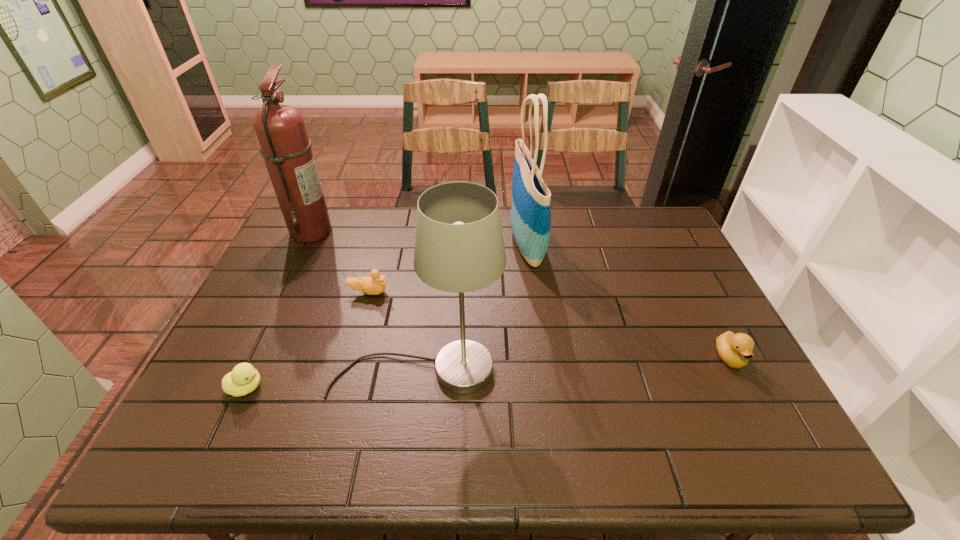
Where is `free spot between the fire extinguisher and the table lamp`? The height and width of the screenshot is (540, 960). free spot between the fire extinguisher and the table lamp is located at coordinates (364, 300).

This screenshot has width=960, height=540. I want to click on the closest object to the leftmost duckling, so click(459, 247).

Find the location of a particular element. the closest object relative to the rightmost object is located at coordinates (530, 218).

Select which duckling appears as the second closest to the table lamp. Please provide its 2D coordinates. Your answer should be formatted as a tuple, i.e. [(x, y)], where the tuple contains the x and y coordinates of a point satisfying the conditions above.

[(375, 284)]

Identify which duckling is located as the nearest to the table lamp. Please provide its 2D coordinates. Your answer should be formatted as a tuple, i.e. [(x, y)], where the tuple contains the x and y coordinates of a point satisfying the conditions above.

[(244, 378)]

Identify the location of free space that satisfies the following two spatial constraints: 1. on the back side of the table lamp; 2. on the front-facing side of the fire extinguisher. (435, 231).

Image resolution: width=960 pixels, height=540 pixels. Find the location of `free spot that satisfies the following two spatial constraints: 1. on the back side of the table lamp; 2. on the left side of the fifth object from left to right`. free spot that satisfies the following two spatial constraints: 1. on the back side of the table lamp; 2. on the left side of the fifth object from left to right is located at coordinates click(x=433, y=243).

You are a GUI agent. You are given a task and a screenshot of the screen. Output one action in this format:
    pyautogui.click(x=<x>, y=<y>)
    Task: Click on the vacant area that satisfies the following two spatial constraints: 1. facing forward on the rightmost object; 2. at the beak of the leftmost duckling
    The height and width of the screenshot is (540, 960).
    Given the screenshot: What is the action you would take?
    pyautogui.click(x=746, y=387)

I want to click on vacant region that satisfies the following two spatial constraints: 1. on the back side of the table lamp; 2. on the right side of the second object from right to left, so click(x=433, y=243).

Locate an element on the screen. The image size is (960, 540). vacant space that satisfies the following two spatial constraints: 1. on the face of the table lamp; 2. on the left side of the third farthest object is located at coordinates (348, 370).